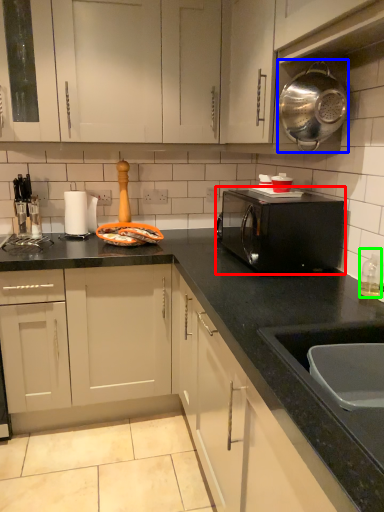
Question: Estimate the real-world distances between objects in this image. Which object is closer to home appliance (highlighted by a red box), kitchen appliance (highlighted by a blue box) or bottle (highlighted by a green box)?

Choices:
 (A) kitchen appliance
 (B) bottle

Answer: (B)